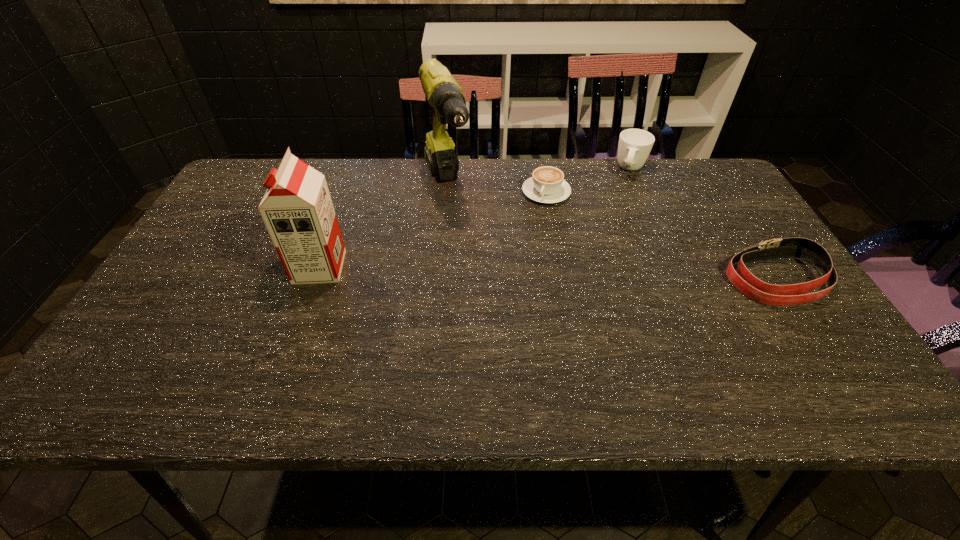
Where is `free spot that satisfies the following two spatial constraints: 1. on the front side of the fourth tallest object; 2. on the right side of the soya milk`? free spot that satisfies the following two spatial constraints: 1. on the front side of the fourth tallest object; 2. on the right side of the soya milk is located at coordinates [x=315, y=280].

This screenshot has width=960, height=540. In order to click on free space that satisfies the following two spatial constraints: 1. on the front side of the rightmost object; 2. on the left side of the leftmost object in this screenshot , I will do `click(315, 280)`.

This screenshot has height=540, width=960. I want to click on vacant space that satisfies the following two spatial constraints: 1. on the front side of the dog collar; 2. on the left side of the second object from left to right, so click(438, 280).